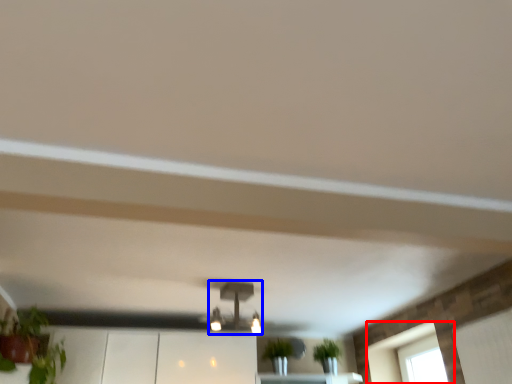
Question: Which point is further to the camera, window (highlighted by a red box) or light fixture (highlighted by a blue box)?

Choices:
 (A) window
 (B) light fixture

Answer: (A)